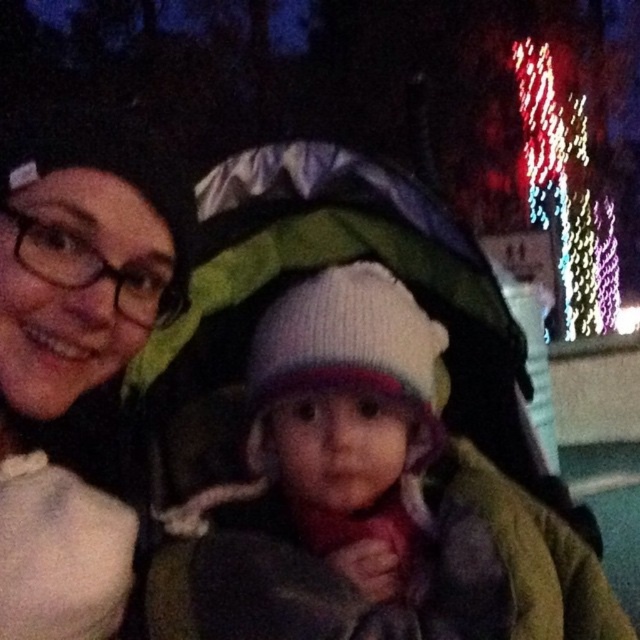
Question: Which object is the closest to the matte black beanie at upper left?

Choices:
 (A) white knitted hat at center
 (B) multicolored fabric baby carriage at center

Answer: (A)

Question: Can you confirm if matte black beanie at upper left is positioned above white knitted hat at center?

Choices:
 (A) yes
 (B) no

Answer: (A)

Question: Does matte black beanie at upper left appear under white knitted hat at center?

Choices:
 (A) yes
 (B) no

Answer: (B)

Question: Based on their relative distances, which object is farther from the multicolored fabric baby carriage at center?

Choices:
 (A) matte black beanie at upper left
 (B) illuminated string lights at upper right
 (C) white knitted hat at center

Answer: (B)

Question: Based on their relative distances, which object is farther from the matte black beanie at upper left?

Choices:
 (A) multicolored fabric baby carriage at center
 (B) illuminated string lights at upper right
 (C) white knitted hat at center

Answer: (B)

Question: Is matte black beanie at upper left bigger than multicolored fabric baby carriage at center?

Choices:
 (A) yes
 (B) no

Answer: (B)